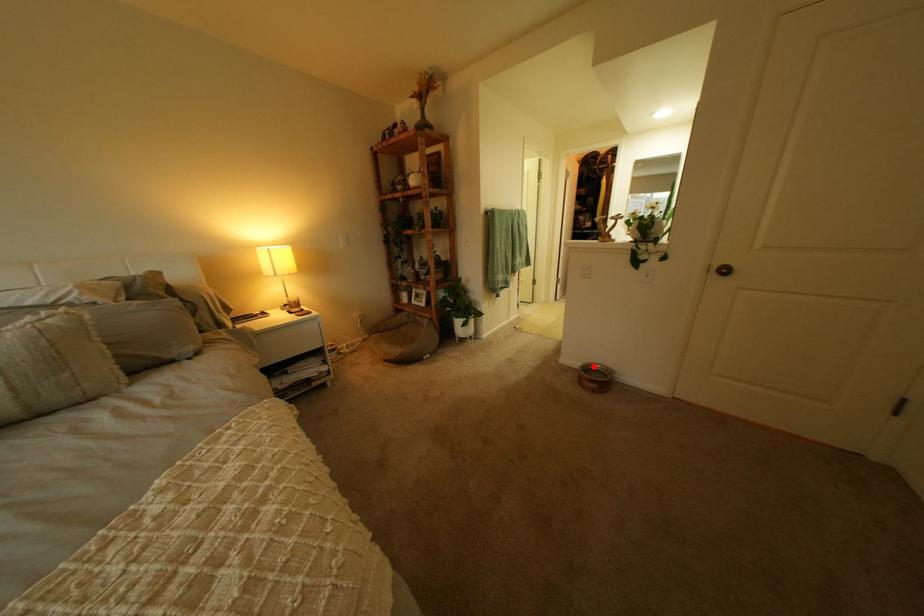
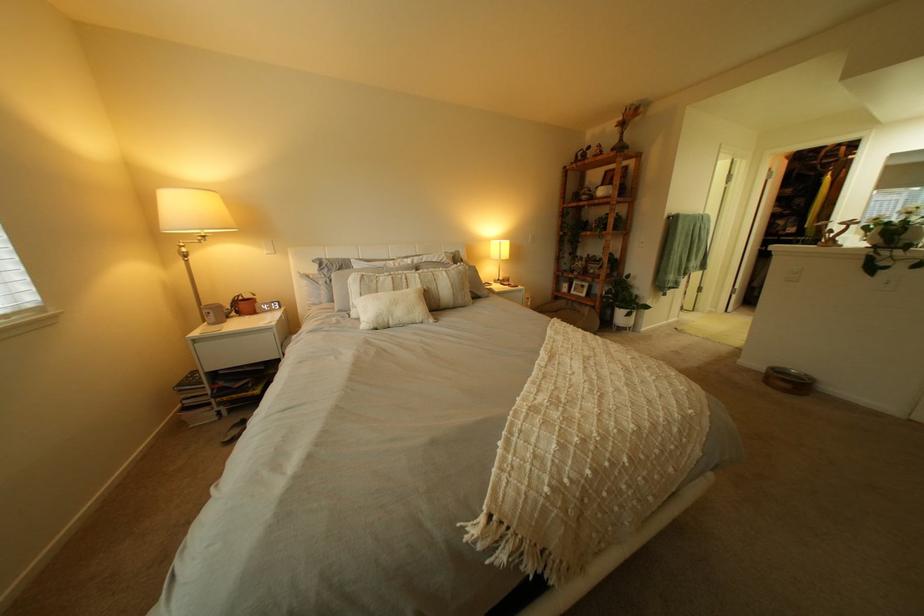
Question: I am providing you with two images of the same scene from different viewpoints. A red point is shown in image1. For the corresponding object point in image2, is it positioned nearer or farther from the camera?

Choices:
 (A) Nearer
 (B) Farther

Answer: (B)